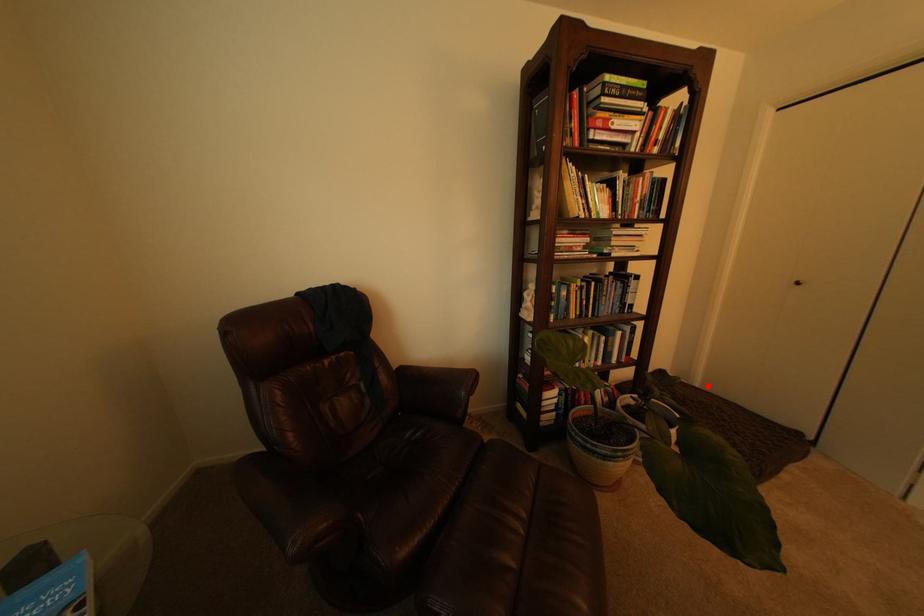
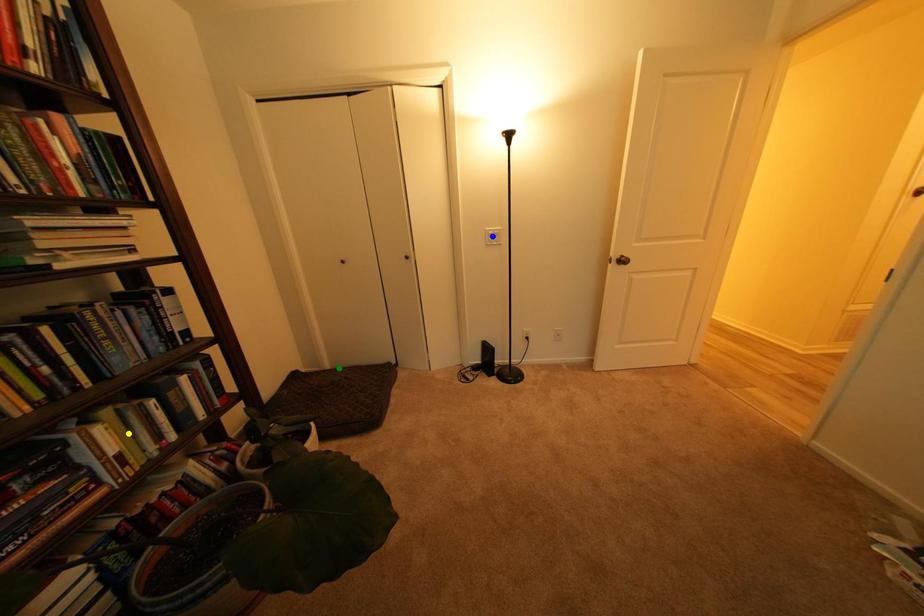
Question: I am providing you with two images of the same scene from different viewpoints. A red point is marked on the first image. You are given multiple points on the second image. In image 2, which mark is for the same physical point as the one in image 1?

Choices:
 (A) blue point
 (B) green point
 (C) yellow point

Answer: (B)